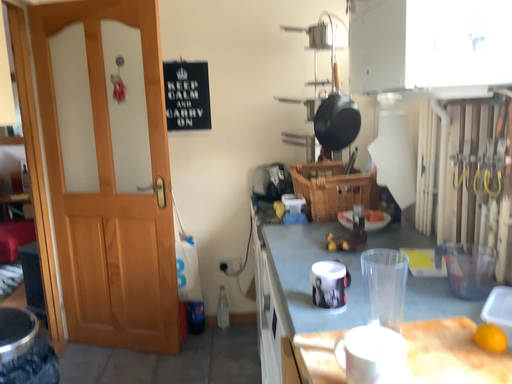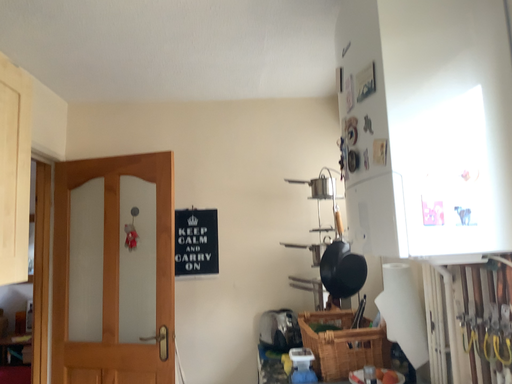
Question: How did the camera likely rotate when shooting the video?

Choices:
 (A) rotated downward
 (B) rotated upward

Answer: (B)